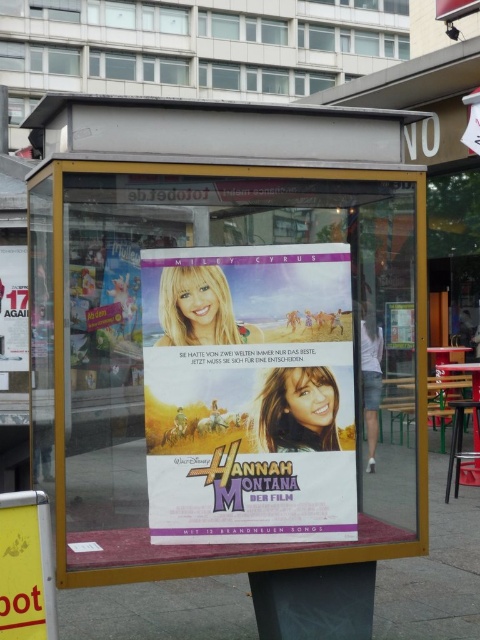
Does transparent glass poster at center have a smaller size compared to matte paper poster at center?

No, transparent glass poster at center is not smaller than matte paper poster at center.

Can you confirm if transparent glass poster at center is positioned above matte paper poster at center?

No, transparent glass poster at center is not above matte paper poster at center.

Who is more forward, (135, 204) or (272, 410)?

Point (272, 410) is in front.

This screenshot has width=480, height=640. I want to click on transparent glass poster at center, so click(x=230, y=348).

Between matte paper poster at center and yellow paper at lower left, which one has less height?

Standing shorter between the two is yellow paper at lower left.

Is point (269, 400) in front of point (4, 632)?

That is False.

This screenshot has width=480, height=640. What are the coordinates of `matte paper poster at center` in the screenshot? It's located at [248, 394].

At what (x,y) coordinates should I click in order to perform the action: click on matte paper poster at center. Please return your answer as a coordinate pair (x, y). The image size is (480, 640). Looking at the image, I should click on (248, 394).

Between transparent glass poster at center and white glossy poster at upper left, which one has more height?

Standing taller between the two is transparent glass poster at center.

At what (x,y) coordinates should I click in order to perform the action: click on transparent glass poster at center. Please return your answer as a coordinate pair (x, y). This screenshot has width=480, height=640. Looking at the image, I should click on (230, 348).

Is point (242, 145) more distant than point (23, 356)?

No, (242, 145) is closer to viewer.

The height and width of the screenshot is (640, 480). I want to click on transparent glass poster at center, so [x=230, y=348].